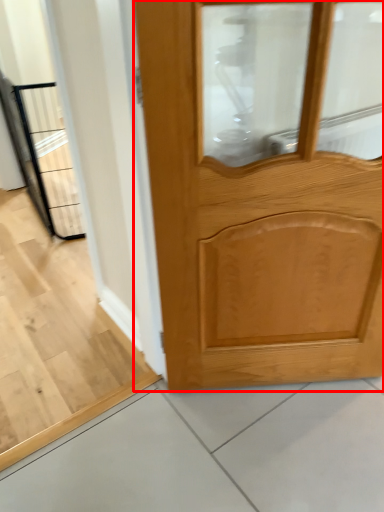
Question: From the image's perspective, what is the correct spatial relationship of door (annotated by the red box) in relation to elevator?

Choices:
 (A) below
 (B) above

Answer: (A)